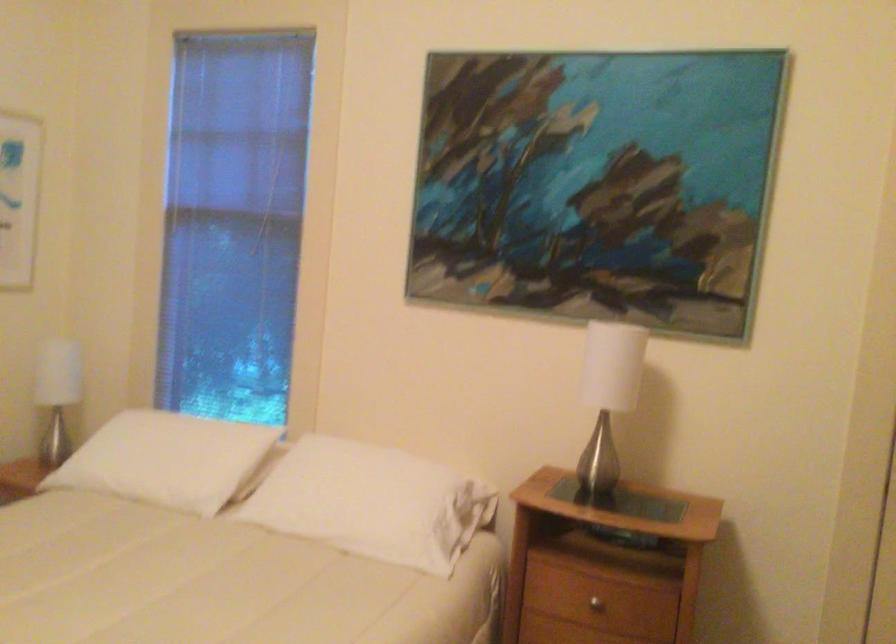
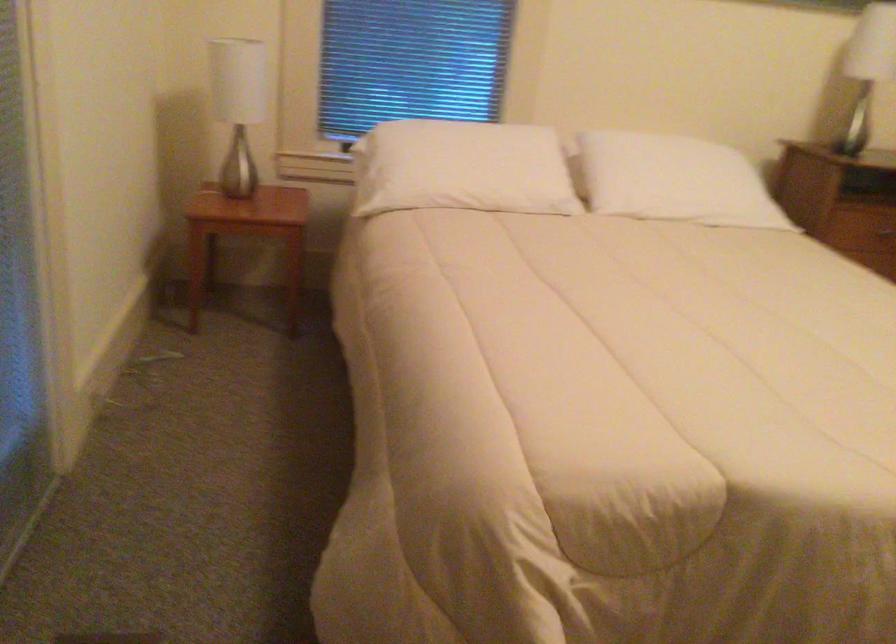
Question: I am providing you with two images of the same scene from different viewpoints. Please identify which objects are invisible in image2.

Choices:
 (A) white pillow
 (B) trash bin flap
 (C) white table lamp
 (D) drawer handle

Answer: (C)